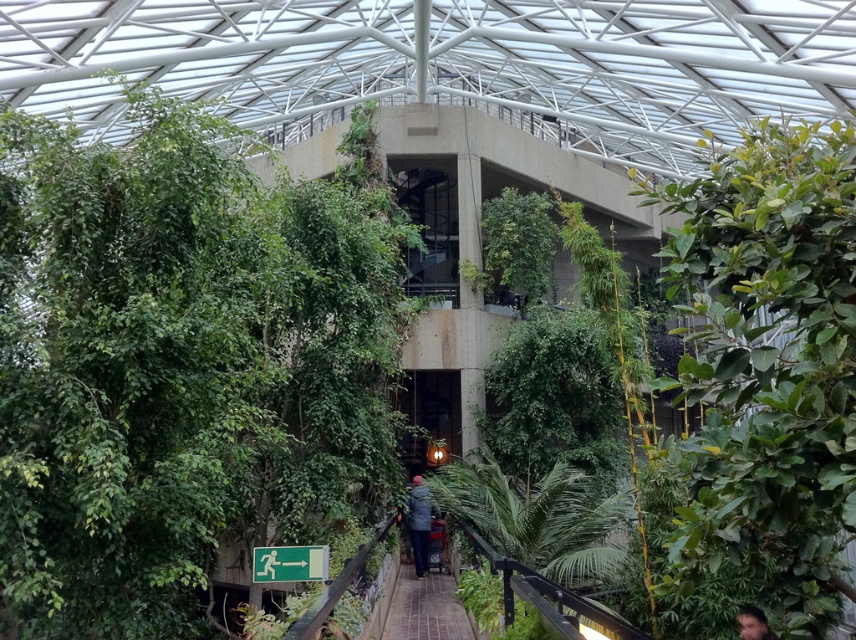
Between point (755, 358) and point (455, 620), which one is positioned behind?

The point (455, 620) is more distant.

Measure the distance from green leafy tree at right to brick paved walkway at center.

A distance of 19.42 feet exists between green leafy tree at right and brick paved walkway at center.

Is point (776, 202) in front of point (420, 602)?

Yes, it is in front of point (420, 602).

Where is `green leafy tree at right`? This screenshot has width=856, height=640. green leafy tree at right is located at coordinates (768, 365).

Is green leafy tree at right above dark gray fabric jacket at center?

Yes, green leafy tree at right is above dark gray fabric jacket at center.

Where is `green leafy tree at right`? The width and height of the screenshot is (856, 640). green leafy tree at right is located at coordinates (768, 365).

How much distance is there between green leafy tree at center and brick paved walkway at center?

A distance of 6.60 meters exists between green leafy tree at center and brick paved walkway at center.

Is point (597, 352) farther from camera compared to point (437, 592)?

Yes, point (597, 352) is farther from viewer.

Where is `green leafy tree at center`? green leafy tree at center is located at coordinates (554, 397).